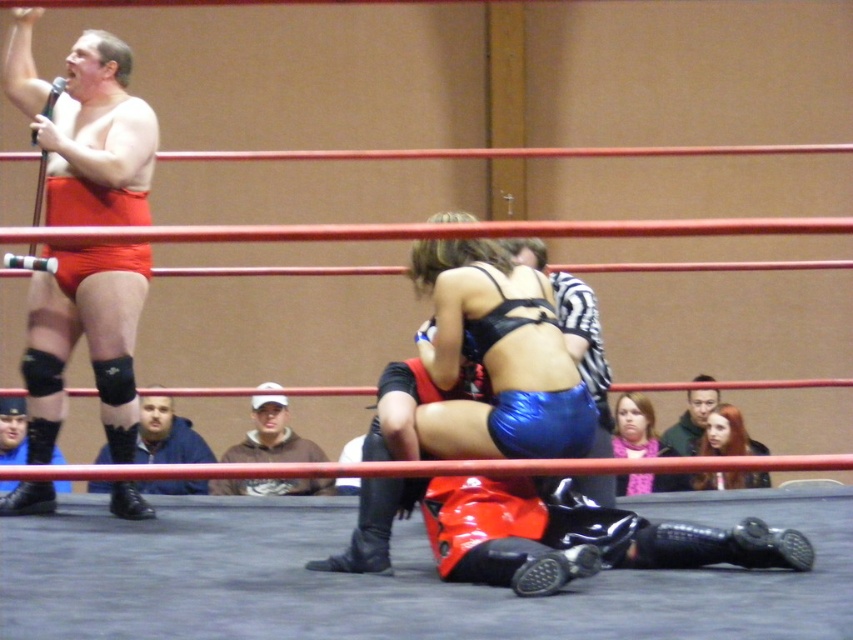
What do you see at coordinates (575, 332) in the screenshot? Image resolution: width=853 pixels, height=640 pixels. I see `shiny blue shorts at center` at bounding box center [575, 332].

Between point (521, 243) and point (657, 451), which one is positioned behind?

The point (657, 451) is behind.

Find the location of a particular element. This screenshot has width=853, height=640. shiny blue shorts at center is located at coordinates (575, 332).

Does brown cotton hoodie at center have a larger size compared to pink fleece scarf at upper center?

Actually, brown cotton hoodie at center might be smaller than pink fleece scarf at upper center.

Is point (262, 444) in front of point (659, 486)?

No.

Describe the element at coordinates (271, 436) in the screenshot. I see `brown cotton hoodie at center` at that location.

Find the location of a particular element. This screenshot has width=853, height=640. brown cotton hoodie at center is located at coordinates (271, 436).

Between brown cotton hoodie at center and blonde hair at upper right, which one appears on the left side from the viewer's perspective?

brown cotton hoodie at center

Does brown cotton hoodie at center have a smaller size compared to blonde hair at upper right?

Yes, brown cotton hoodie at center is smaller than blonde hair at upper right.

Which is behind, point (271, 481) or point (706, 481)?

Point (271, 481)

Locate an element on the screen. The height and width of the screenshot is (640, 853). brown cotton hoodie at center is located at coordinates (271, 436).